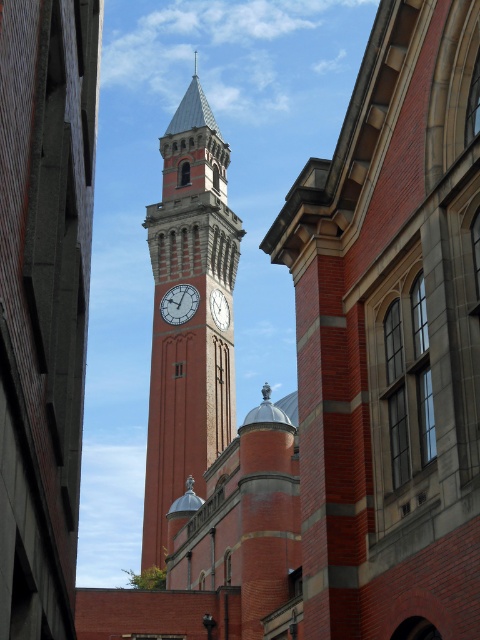
You are standing in front of the clock tower and want to take a photo of the white clock face at center. To get the best shot, should you move to the left or right side of the red brick clock tower at center?

The red brick clock tower at center is positioned on the left side of the white clock face at center. Therefore, you should move to the right side of the red brick clock tower at center to get a clear view of the white clock face at center.

You are standing in front of the clock tower and want to see the white clock face at center. Which direction should you look relative to the red brick clock tower at center?

The red brick clock tower at center is located above the white clock face at center, so you should look downward from the red brick clock tower at center to see the white clock face at center.

You are an architect examining the image of a clock tower. You notice two objects labeled as the red brick clock tower at center and the matte brick clock at center. Which one is situated higher in the image?

The red brick clock tower at center is situated higher than the matte brick clock at center in the image.